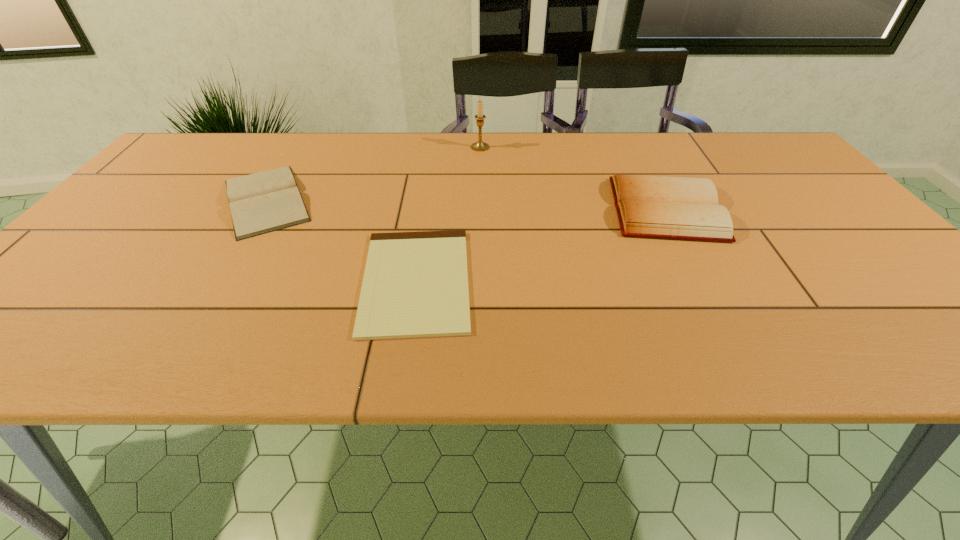
What are the coordinates of `vacant region located on the back of the shortest object` in the screenshot? It's located at (432, 176).

Find the location of `candle holder that is at the far edge`. candle holder that is at the far edge is located at coordinates (480, 145).

At what (x,y) coordinates should I click in order to perform the action: click on Bible located at the far edge. Please return your answer as a coordinate pair (x, y). This screenshot has height=540, width=960. Looking at the image, I should click on (263, 202).

Find the location of a particular element. This screenshot has width=960, height=540. object at the near edge is located at coordinates (415, 285).

Find the location of a particular element. vacant area at the far edge of the desktop is located at coordinates (385, 140).

You are a GUI agent. You are given a task and a screenshot of the screen. Output one action in this format:
    pyautogui.click(x=<x>, y=<y>)
    Task: Click on the free space at the near edge
    The image size is (960, 540).
    Given the screenshot: What is the action you would take?
    pyautogui.click(x=315, y=335)

In the image, there is a desktop. Where is `free space at the left edge`? This screenshot has height=540, width=960. free space at the left edge is located at coordinates (196, 185).

Identify the location of free point at the right edge. (761, 177).

This screenshot has height=540, width=960. In order to click on vacant space at the far right corner in this screenshot , I will do `click(736, 137)`.

I want to click on unoccupied area between the rightmost object and the leftmost object, so click(x=466, y=205).